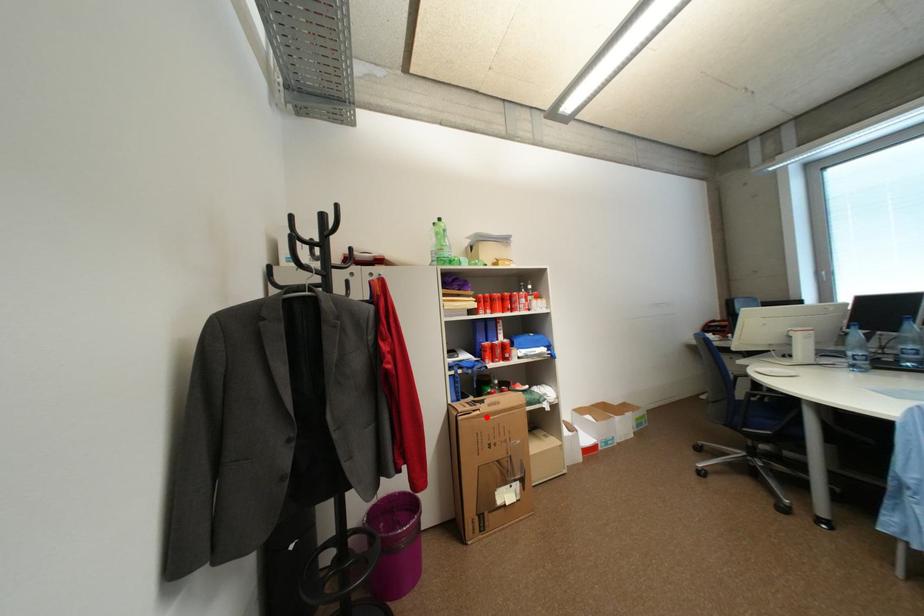
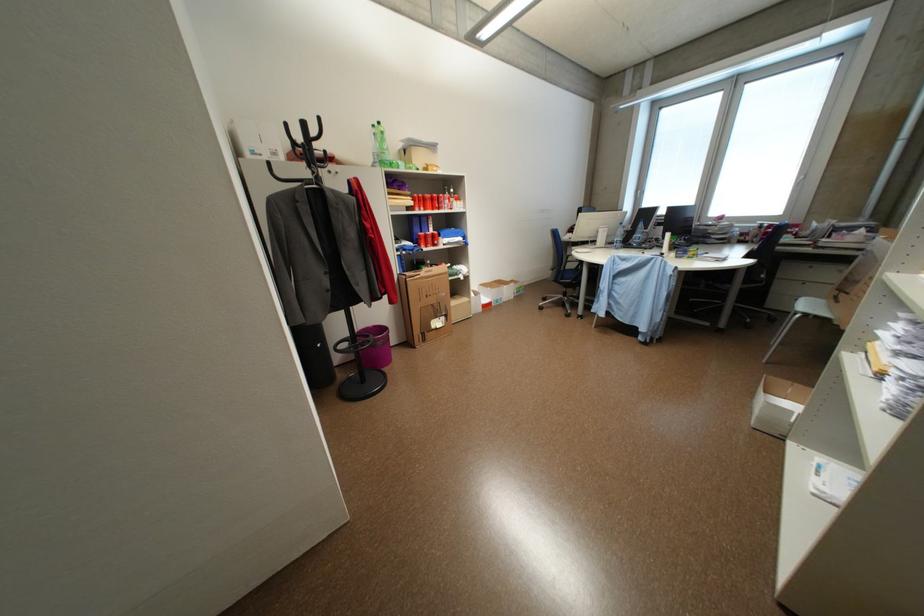
Question: I am providing you with two images of the same scene from different viewpoints. In image1, a red point is highlighted. Considering the same 3D point in image2, which of the following is correct?

Choices:
 (A) It is closer
 (B) It is farther

Answer: (A)